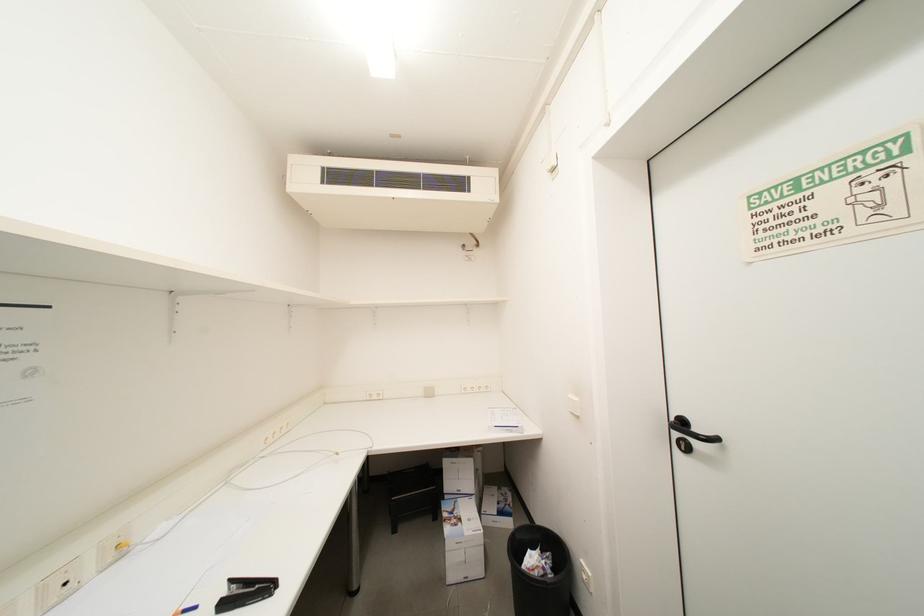
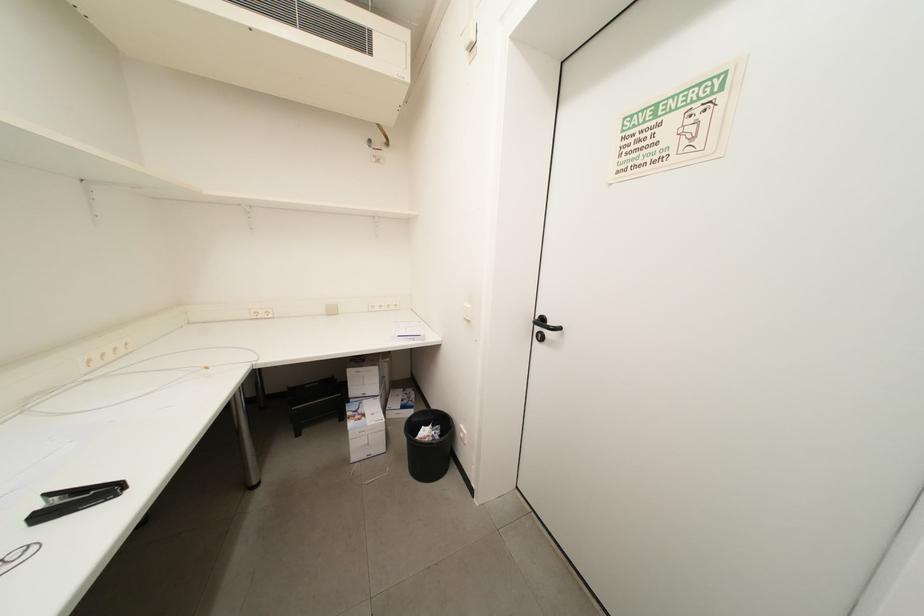
The first image is from the beginning of the video and the second image is from the end. How did the camera likely rotate when shooting the video?

The camera's rotation is toward right-down.